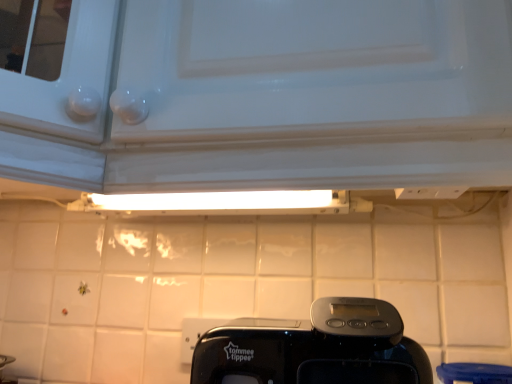
Question: Is white glossy tile at lower left bigger or smaller than black plastic toaster at center?

Choices:
 (A) small
 (B) big

Answer: (A)

Question: From the image's perspective, is white glossy tile at lower left positioned above or below black plastic toaster at center?

Choices:
 (A) above
 (B) below

Answer: (B)

Question: Which is correct: white glossy tile at lower left is inside black plastic toaster at center, or outside of it?

Choices:
 (A) inside
 (B) outside

Answer: (B)

Question: Is point (325, 322) closer or farther from the camera than point (40, 362)?

Choices:
 (A) closer
 (B) farther

Answer: (A)

Question: Considering their positions, is black plastic toaster at center located in front of or behind white glossy tile at lower left?

Choices:
 (A) behind
 (B) front

Answer: (B)

Question: From their relative heights in the image, would you say black plastic toaster at center is taller or shorter than white glossy tile at lower left?

Choices:
 (A) tall
 (B) short

Answer: (B)

Question: Is black plastic toaster at center situated inside white glossy tile at lower left or outside?

Choices:
 (A) inside
 (B) outside

Answer: (B)